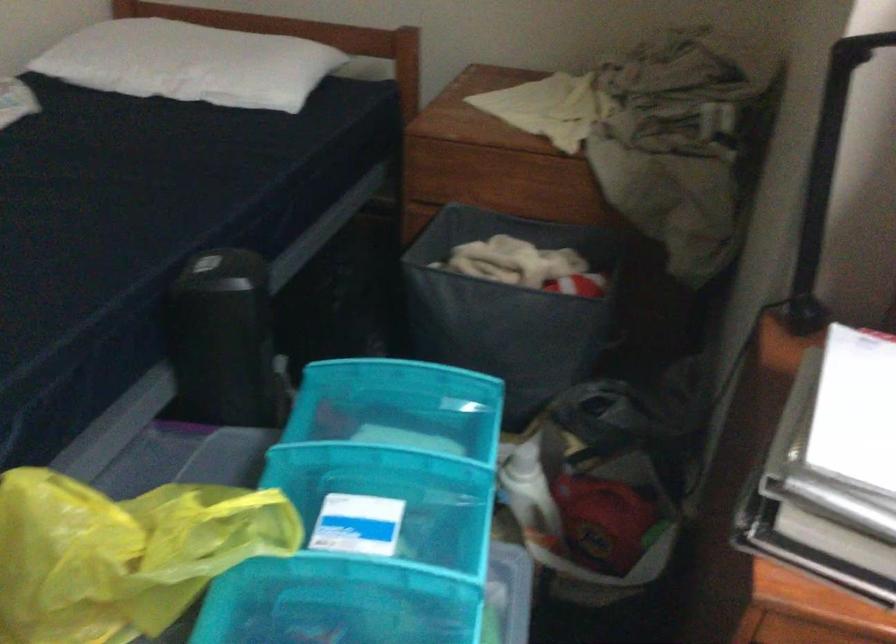
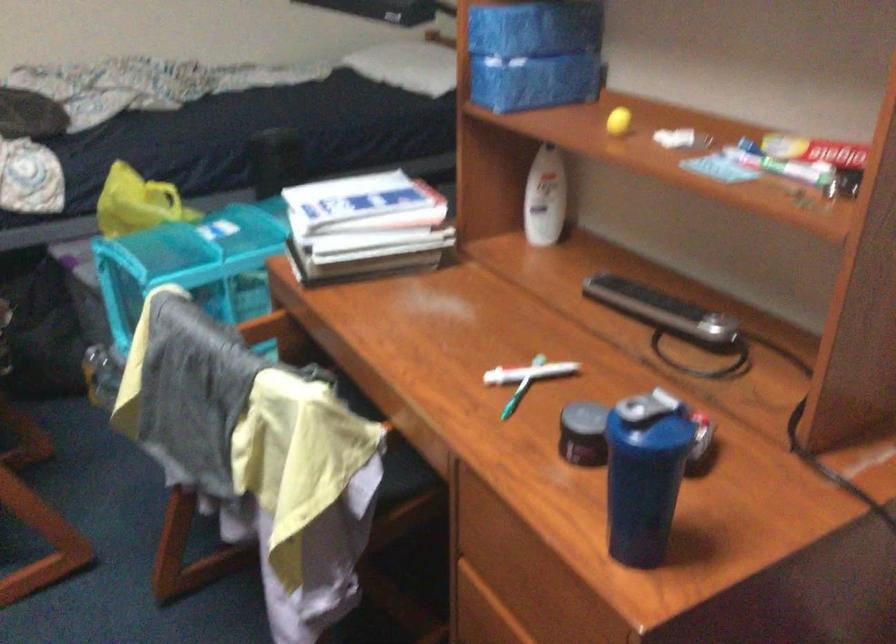
Question: I am providing you with two images of the same scene from different viewpoints. Please identify which objects are invisible in image2.

Choices:
 (A) blue tissue box
 (B) blue shaker cup
 (C) grey fabric bin
 (D) blue foam tile

Answer: (C)